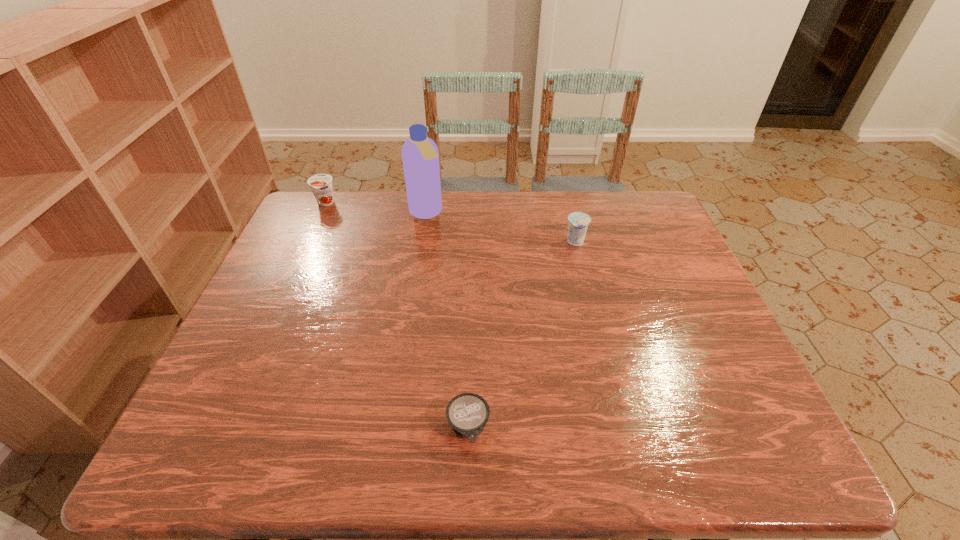
Identify which object is the closest to the second object from right to left. Please provide its 2D coordinates. Your answer should be formatted as a tuple, i.e. [(x, y)], where the tuple contains the x and y coordinates of a point satisfying the conditions above.

[(578, 222)]

The image size is (960, 540). I want to click on object identified as the second closest to the third farthest object, so click(x=467, y=413).

I want to click on yogurt identified as the closest to the third farthest object, so click(467, 413).

Find the location of a particular element. The height and width of the screenshot is (540, 960). yogurt that is the second nearest to the shortest object is located at coordinates (321, 184).

Find the location of a particular element. free region that satisfies the following two spatial constraints: 1. on the front side of the second farthest yogurt; 2. on the left side of the tallest object is located at coordinates (421, 242).

You are a GUI agent. You are given a task and a screenshot of the screen. Output one action in this format:
    pyautogui.click(x=<x>, y=<y>)
    Task: Click on the free space that satisfies the following two spatial constraints: 1. on the front side of the second object from left to right; 2. on the right side of the leftmost object
    This screenshot has width=960, height=540.
    Given the screenshot: What is the action you would take?
    pyautogui.click(x=321, y=213)